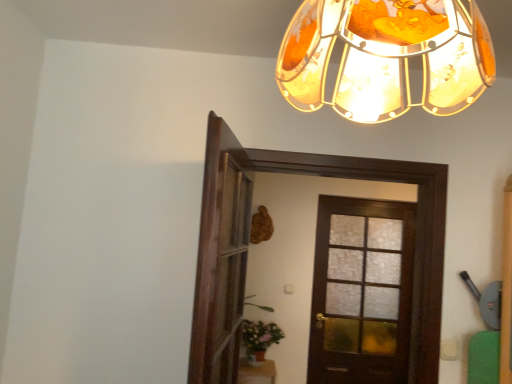
Question: Is translucent amber glass lampshade at upper center to the right of green matte plant at lower center from the viewer's perspective?

Choices:
 (A) yes
 (B) no

Answer: (A)

Question: Does translucent amber glass lampshade at upper center have a larger size compared to green matte plant at lower center?

Choices:
 (A) no
 (B) yes

Answer: (A)

Question: Can you confirm if translucent amber glass lampshade at upper center is positioned to the left of green matte plant at lower center?

Choices:
 (A) no
 (B) yes

Answer: (A)

Question: Is translucent amber glass lampshade at upper center smaller than green matte plant at lower center?

Choices:
 (A) yes
 (B) no

Answer: (A)

Question: From a real-world perspective, is translucent amber glass lampshade at upper center on top of green matte plant at lower center?

Choices:
 (A) yes
 (B) no

Answer: (A)

Question: From the image's perspective, is dark wood door at center, marked as the second door in a back-to-front arrangement, positioned above or below translucent amber glass lampshade at upper center?

Choices:
 (A) above
 (B) below

Answer: (B)

Question: Relative to translucent amber glass lampshade at upper center, is dark wood door at center, which is counted as the 1th door, starting from the front, in front or behind?

Choices:
 (A) behind
 (B) front

Answer: (A)

Question: Is dark wood door at center, which is counted as the 1th door, starting from the front, inside or outside of translucent amber glass lampshade at upper center?

Choices:
 (A) inside
 (B) outside

Answer: (B)

Question: Looking at their shapes, would you say dark wood door at center, marked as the second door in a back-to-front arrangement, is wider or thinner than translucent amber glass lampshade at upper center?

Choices:
 (A) thin
 (B) wide

Answer: (A)

Question: Looking at their shapes, would you say wooden screen door at center is wider or thinner than dark wood door at center, which is the first door from back to front?

Choices:
 (A) wide
 (B) thin

Answer: (A)

Question: From their relative heights in the image, would you say wooden screen door at center is taller or shorter than dark wood door at center, the 2th door in the front-to-back sequence?

Choices:
 (A) short
 (B) tall

Answer: (A)

Question: Visually, is wooden screen door at center positioned to the left or to the right of dark wood door at center, which is the first door from back to front?

Choices:
 (A) right
 (B) left

Answer: (B)

Question: Looking at the image, does wooden screen door at center seem bigger or smaller compared to dark wood door at center, which is the first door from back to front?

Choices:
 (A) big
 (B) small

Answer: (B)

Question: Is point (241, 253) closer or farther from the camera than point (250, 350)?

Choices:
 (A) farther
 (B) closer

Answer: (B)

Question: From a real-world perspective, is wooden screen door at center physically located above or below green matte plant at lower center?

Choices:
 (A) below
 (B) above

Answer: (B)